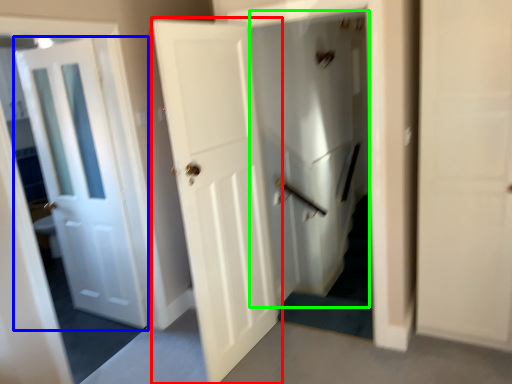
Question: Based on their relative distances, which object is farther from door (highlighted by a red box)? Choose from door (highlighted by a blue box) and elevator (highlighted by a green box).

Choices:
 (A) door
 (B) elevator

Answer: (B)